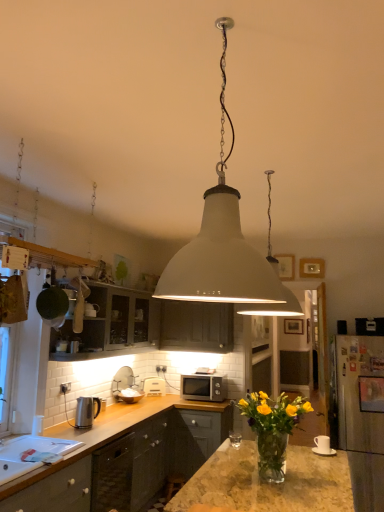
In order to click on vacant space to the right of polished stainless steel kettle at lower left, arranged as the second appliance when viewed from the right in this screenshot , I will do `click(115, 424)`.